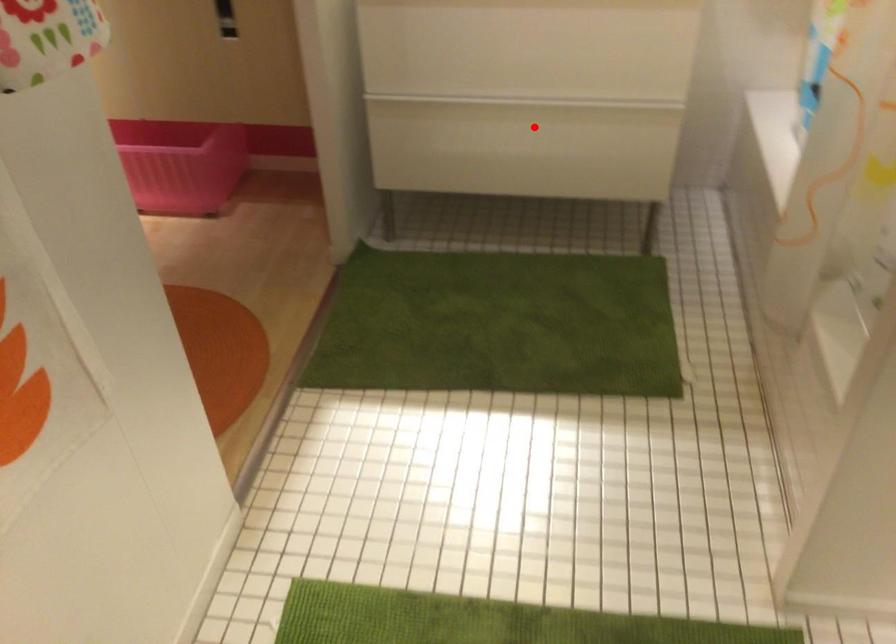
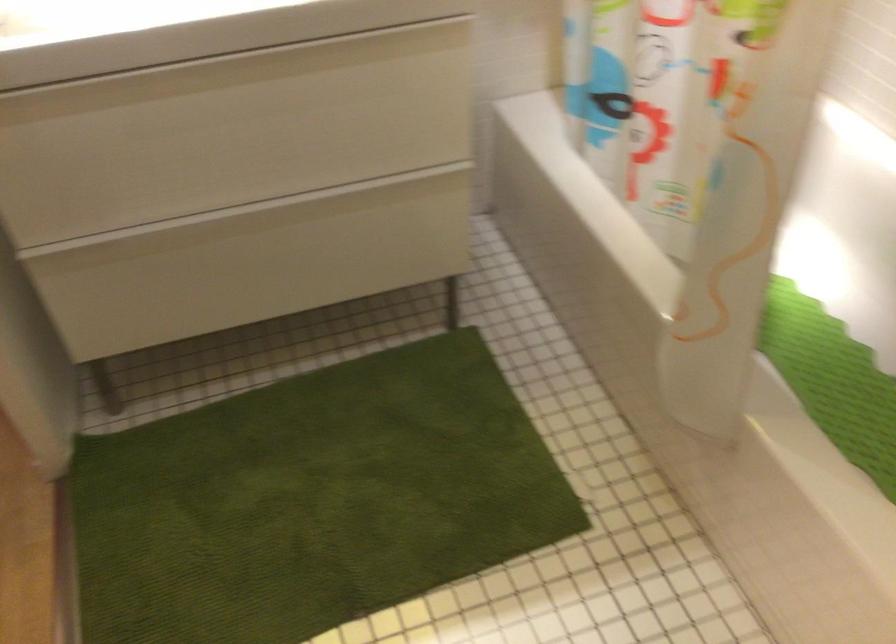
Find the pixel in the second image that matches the highlighted location in the first image.

(289, 238)